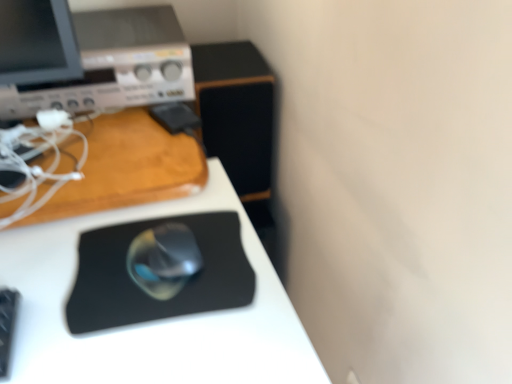
Question: From the image's perspective, is satin silver mouse at center located above or below black rubber mousepad at center?

Choices:
 (A) above
 (B) below

Answer: (A)

Question: Considering the positions of point (174, 241) and point (123, 279), is point (174, 241) closer or farther from the camera than point (123, 279)?

Choices:
 (A) closer
 (B) farther

Answer: (B)

Question: Which object is the closest to the black rubber mousepad at center?

Choices:
 (A) black matte mouse pad at center
 (B) matte silver desktop computer at upper left
 (C) satin silver mouse at center

Answer: (C)

Question: Estimate the real-world distances between objects in this image. Which object is closer to the black matte mouse pad at center?

Choices:
 (A) black rubber mousepad at center
 (B) satin silver mouse at center
 (C) matte silver desktop computer at upper left

Answer: (A)